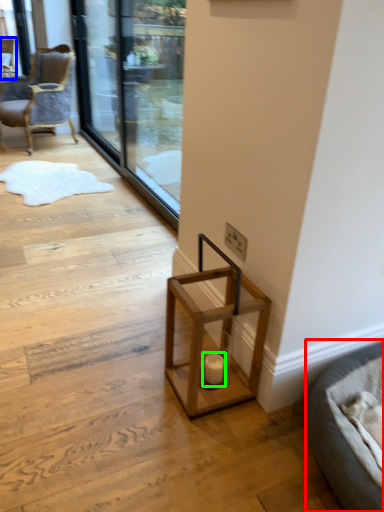
Question: Which object is positioned farthest from furniture (highlighted by a red box)? Select from chair (highlighted by a blue box) and candle holder (highlighted by a green box).

Choices:
 (A) chair
 (B) candle holder

Answer: (A)